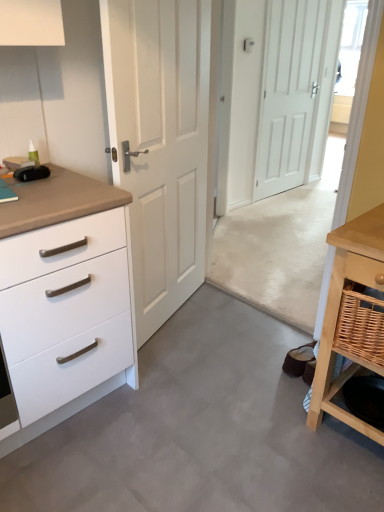
Question: From a real-world perspective, is white matte chest of drawers at left on white matte door at center, positioned as the second door in front-to-back order?

Choices:
 (A) yes
 (B) no

Answer: (B)

Question: Is white matte chest of drawers at left shorter than white matte door at center, the first door in the back-to-front sequence?

Choices:
 (A) yes
 (B) no

Answer: (A)

Question: Would you consider white matte chest of drawers at left to be distant from white matte door at center, positioned as the second door in front-to-back order?

Choices:
 (A) yes
 (B) no

Answer: (A)

Question: Is white matte chest of drawers at left outside white matte door at center, positioned as the second door in front-to-back order?

Choices:
 (A) no
 (B) yes

Answer: (B)

Question: Considering the relative positions of white matte chest of drawers at left and white matte door at center, placed as the 2th door when sorted from left to right, in the image provided, is white matte chest of drawers at left in front of white matte door at center, placed as the 2th door when sorted from left to right,?

Choices:
 (A) no
 (B) yes

Answer: (B)

Question: Is light wood table at lower right taller or shorter than gray laminate floor at center?

Choices:
 (A) short
 (B) tall

Answer: (B)

Question: Do you think light wood table at lower right is within gray laminate floor at center, or outside of it?

Choices:
 (A) outside
 (B) inside

Answer: (A)

Question: In the image, is light wood table at lower right on the left side or the right side of gray laminate floor at center?

Choices:
 (A) right
 (B) left

Answer: (A)

Question: Does point (332, 238) appear closer or farther from the camera than point (307, 494)?

Choices:
 (A) closer
 (B) farther

Answer: (A)

Question: Considering the relative positions of gray laminate floor at center and white matte chest of drawers at left in the image provided, is gray laminate floor at center to the left or to the right of white matte chest of drawers at left?

Choices:
 (A) right
 (B) left

Answer: (A)

Question: From a real-world perspective, relative to white matte chest of drawers at left, is gray laminate floor at center vertically above or below?

Choices:
 (A) below
 (B) above

Answer: (A)

Question: From their relative heights in the image, would you say gray laminate floor at center is taller or shorter than white matte chest of drawers at left?

Choices:
 (A) tall
 (B) short

Answer: (B)

Question: Is gray laminate floor at center in front of or behind white matte chest of drawers at left in the image?

Choices:
 (A) behind
 (B) front

Answer: (B)

Question: Considering their positions, is white matte door at center, the first door in the back-to-front sequence, located in front of or behind transparent glass door at upper right?

Choices:
 (A) front
 (B) behind

Answer: (A)

Question: Considering the positions of white matte door at center, the first door in the back-to-front sequence, and transparent glass door at upper right in the image, is white matte door at center, the first door in the back-to-front sequence, bigger or smaller than transparent glass door at upper right?

Choices:
 (A) small
 (B) big

Answer: (B)